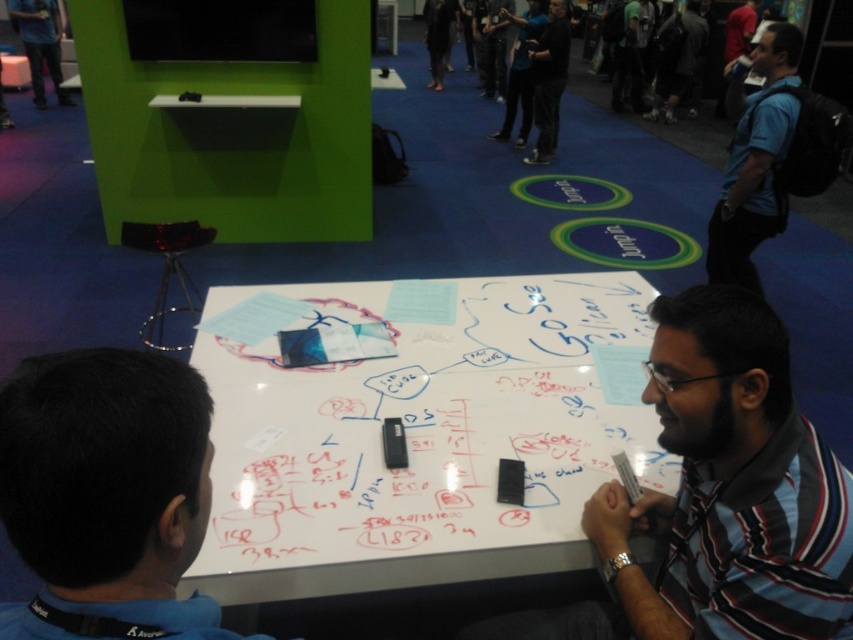
You are standing in front of the table at the tech event. There are two points marked on the table surface. The first point is at coordinates point (62, 388) and the second point is at point (747, 248). If you want to reach the point that is closer to you, which one should you choose?

You should choose point (62, 388) because it is closer to the camera than point (747, 248).

You are a photographer standing at the back of the room. You want to take a photo of both the blue shirt at lower left and the blue shirt at right in the same frame. Given that your camera has a maximum focus range of 3 meters, will both subjects be in focus?

The blue shirt at lower left and blue shirt at right are 3.03 meters apart from each other. Since the camera can only focus within 3 meters, the distance between them exceeds the focus range. Therefore, both subjects might not be in focus simultaneously.

You are a photographer at the event and want to capture a photo where both the blue shirt at lower left and the black matte shirt at center are visible. Based on their heights, which shirt should be placed closer to the camera to ensure both are fully visible in the frame?

The blue shirt at lower left is shorter than the black matte shirt at center. To ensure both are fully visible, position the blue shirt at lower left closer to the camera so its shorter height doesn